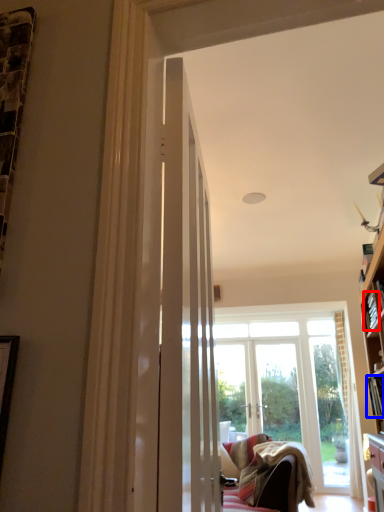
Question: Which point is closer to the camera, book (highlighted by a red box) or book (highlighted by a blue box)?

Choices:
 (A) book
 (B) book

Answer: (B)